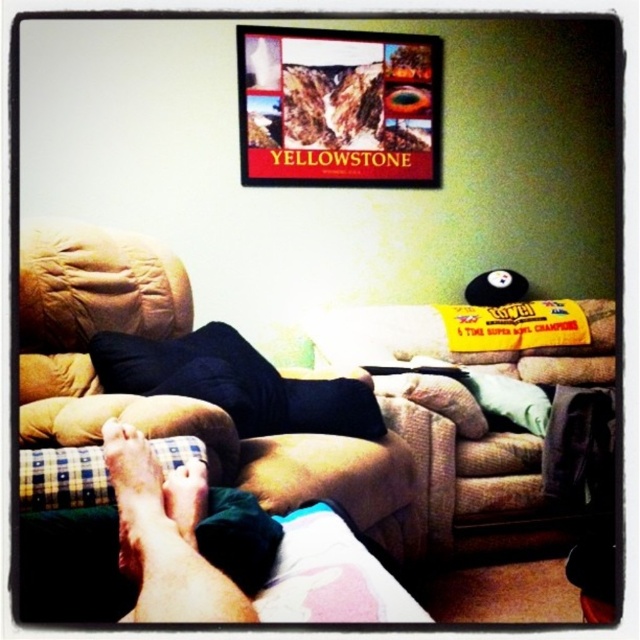
Can you confirm if brown fabric couch at center is wider than smooth skin foot at lower left?

Yes, brown fabric couch at center is wider than smooth skin foot at lower left.

Can you confirm if brown fabric couch at center is positioned to the left of smooth skin foot at lower left?

In fact, brown fabric couch at center is to the right of smooth skin foot at lower left.

Between point (513, 499) and point (186, 506), which one is positioned in front?

Point (186, 506)

The height and width of the screenshot is (640, 640). Find the location of `brown fabric couch at center`. brown fabric couch at center is located at coordinates (481, 413).

Looking at this image, can you confirm if brown fabric armchair at lower left is thinner than smooth skin foot at lower left?

No, brown fabric armchair at lower left is not thinner than smooth skin foot at lower left.

Is the position of brown fabric armchair at lower left less distant than that of smooth skin foot at lower left?

No, brown fabric armchair at lower left is further to the viewer.

What do you see at coordinates (177, 396) in the screenshot? I see `brown fabric armchair at lower left` at bounding box center [177, 396].

The height and width of the screenshot is (640, 640). In order to click on brown fabric armchair at lower left in this screenshot , I will do `click(177, 396)`.

Can you confirm if brown fabric armchair at lower left is smaller than wooden yellowstone poster at upper center?

No.

Which is below, brown fabric armchair at lower left or wooden yellowstone poster at upper center?

brown fabric armchair at lower left

Image resolution: width=640 pixels, height=640 pixels. I want to click on brown fabric armchair at lower left, so click(x=177, y=396).